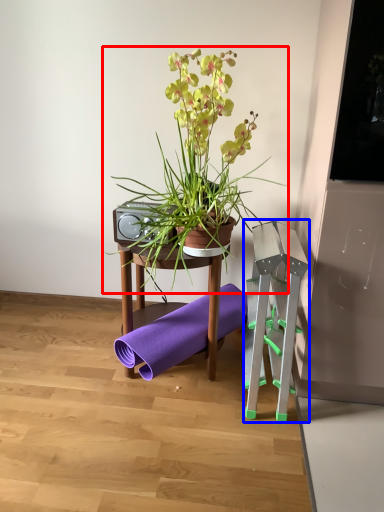
Question: Which point is further to the camera, houseplant (highlighted by a red box) or step stool (highlighted by a blue box)?

Choices:
 (A) houseplant
 (B) step stool

Answer: (B)